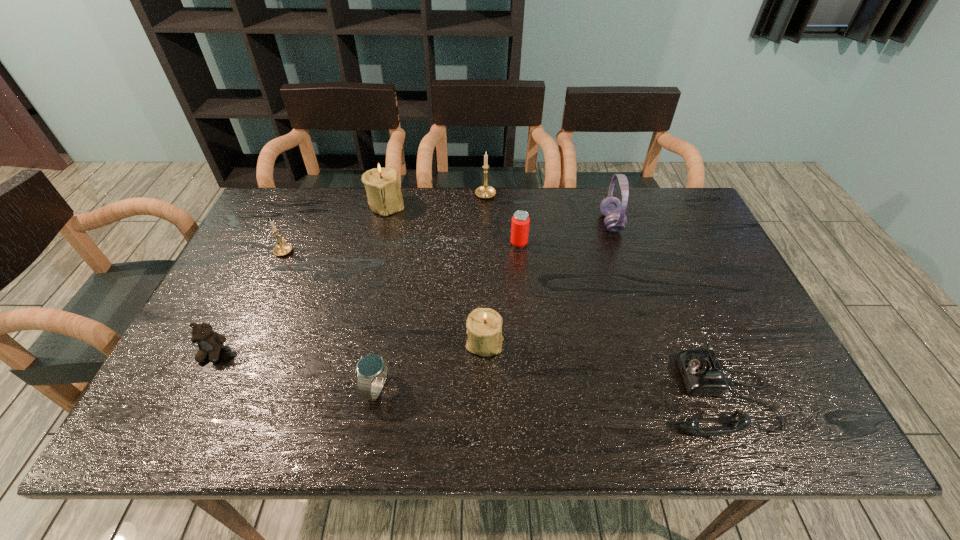
Identify the location of free space located on the handle side of the nearer gold candle holder. This screenshot has height=540, width=960. (307, 199).

This screenshot has height=540, width=960. Identify the location of free space located 0.140m on the handle side of the nearer gold candle holder. (301, 214).

Image resolution: width=960 pixels, height=540 pixels. I want to click on vacant space located 0.080m on the right of the smaller beige candle_holder, so click(537, 342).

The image size is (960, 540). Identify the location of free space located on the front of the beer can. (526, 318).

Where is `vacant area situated on the face of the teddy bear`? Image resolution: width=960 pixels, height=540 pixels. vacant area situated on the face of the teddy bear is located at coordinates point(194,392).

Find the location of a particular element. This screenshot has width=960, height=540. blank space located on the right of the blue watch is located at coordinates (447, 388).

Identify the location of vacant space situated on the dial of the telephone. (529, 393).

Find the location of a particular element. free spot located on the dial of the telephone is located at coordinates (520, 393).

Identify the location of free location located 0.080m on the dial of the telephone. (628, 393).

You are a GUI agent. You are given a task and a screenshot of the screen. Output one action in this format:
    pyautogui.click(x=<x>, y=<y>)
    Task: Click on the headset that is at the far edge
    
    Given the screenshot: What is the action you would take?
    pyautogui.click(x=611, y=207)